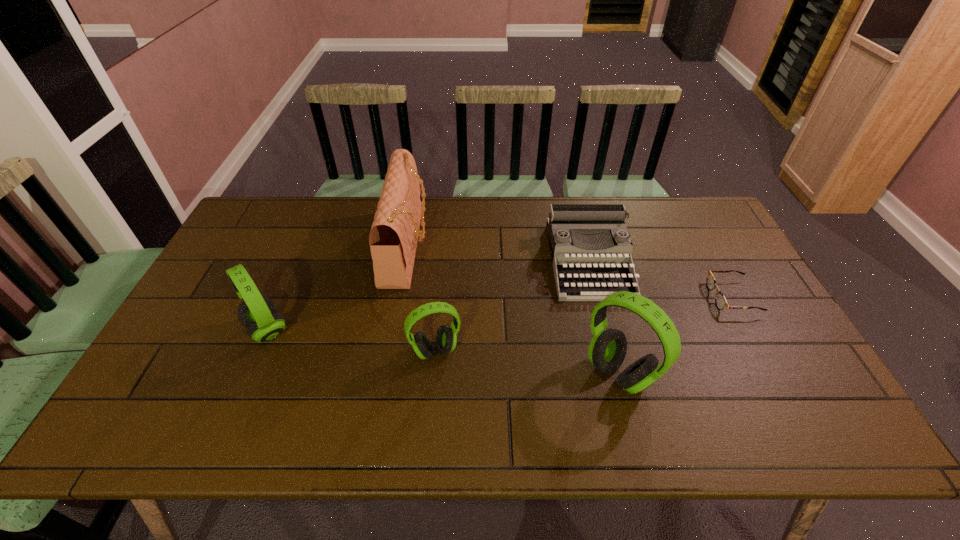
Please point out where to position a new headset on the right to maintain spacing. Please provide its 2D coordinates. Your answer should be formatted as a tuple, i.e. [(x, y)], where the tuple contains the x and y coordinates of a point satisfying the conditions above.

[(818, 399)]